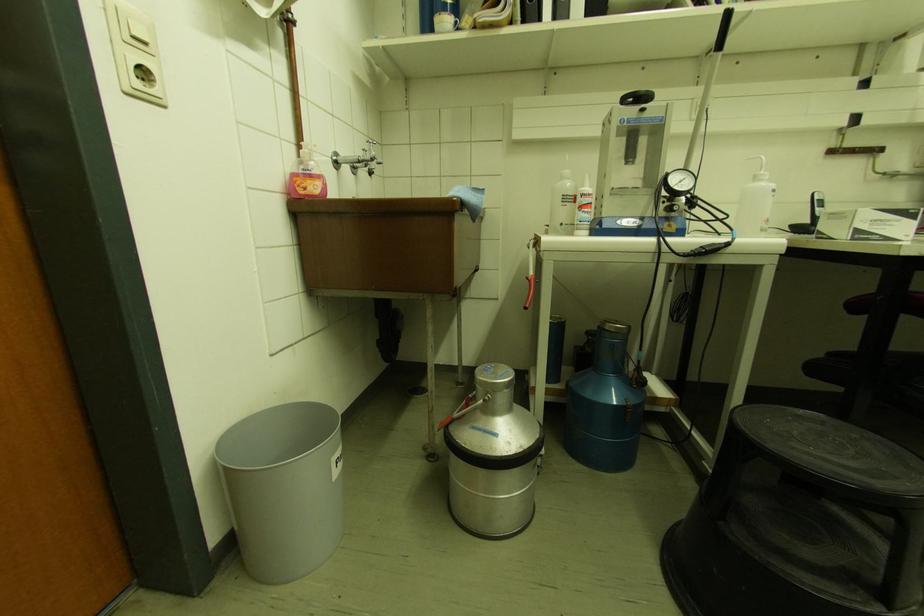
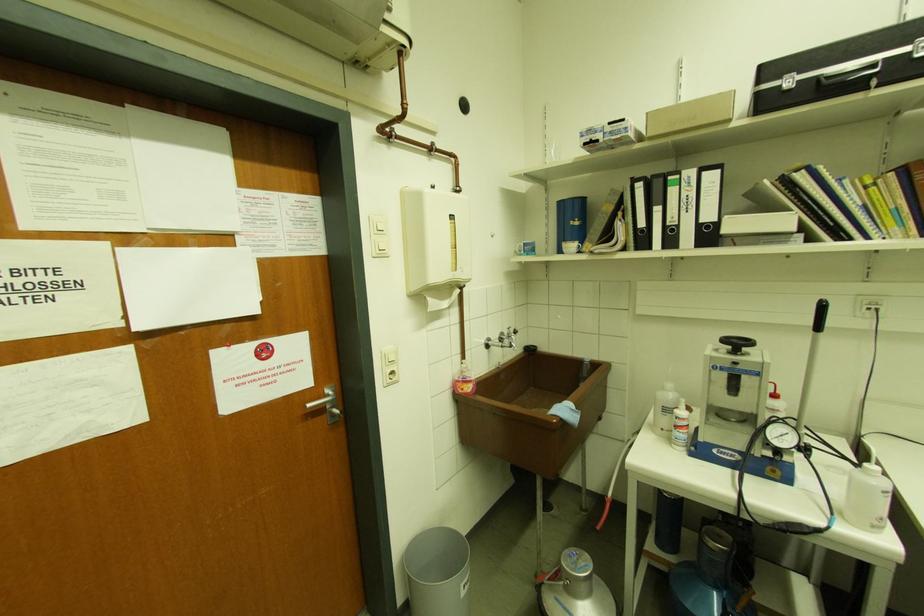
In the second image, find the point that corresponds to (x=590, y=185) in the first image.

(687, 408)